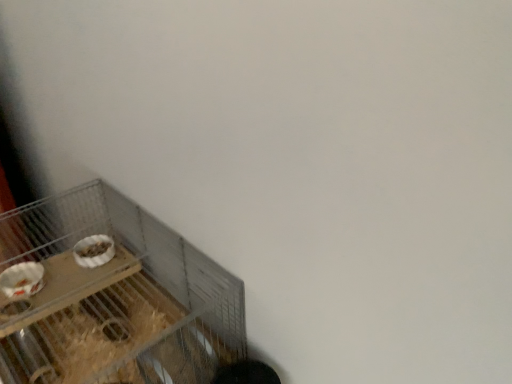
What do you see at coordinates (115, 298) in the screenshot?
I see `metal wire cage at lower left` at bounding box center [115, 298].

Measure the distance between point [38,250] and camera.

28.31 inches.

Find the location of a particular element. metal wire cage at lower left is located at coordinates (115, 298).

The height and width of the screenshot is (384, 512). Find the location of `metal wire cage at lower left`. metal wire cage at lower left is located at coordinates (115, 298).